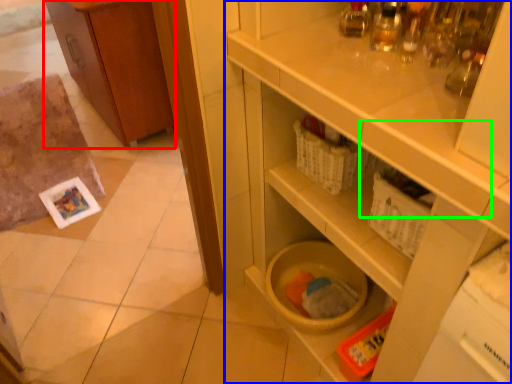
Question: Which object is positioned closest to cabinetry (highlighted by a red box)? Select from cupboard (highlighted by a blue box) and drawer (highlighted by a green box).

Choices:
 (A) cupboard
 (B) drawer

Answer: (A)